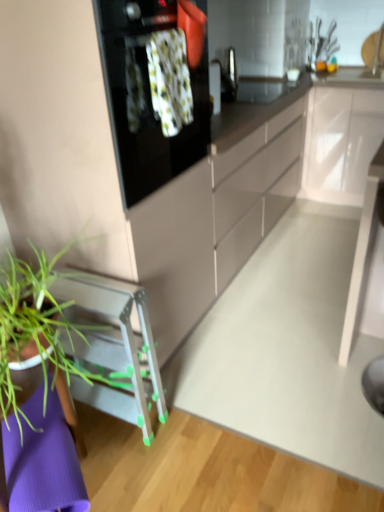
What is the approximate width of white glossy table at center?

21.30 inches.

Locate an element on the screen. The width and height of the screenshot is (384, 512). black glass oven at upper center is located at coordinates (146, 97).

In order to face white glossy cabinet at upper right, should I rotate leftwards or rightwards?

It's best to rotate right around 18.645 degrees.

Identify the location of white glossy table at center. The width and height of the screenshot is (384, 512). (363, 251).

Is black glass oven at upper center turned away from green plastic stool at lower left?

No, green plastic stool at lower left is not at the back of black glass oven at upper center.

Where is `furniture located underneath the black glass oven at upper center (from a real-world perspective)`? furniture located underneath the black glass oven at upper center (from a real-world perspective) is located at coordinates (112, 346).

Does black glass oven at upper center have a greater width compared to green plastic stool at lower left?

Incorrect, the width of black glass oven at upper center does not surpass that of green plastic stool at lower left.

Is black glass oven at upper center next to green plastic stool at lower left and touching it?

They are not placed beside each other.

Image resolution: width=384 pixels, height=512 pixels. In the image, there is a white glossy table at center. In order to click on kitchen appliance above it (from the image's perspective) in this screenshot , I will do `click(146, 97)`.

Does black glass oven at upper center touch white glossy table at center?

black glass oven at upper center is not next to white glossy table at center, and they're not touching.

Between black glass oven at upper center and white glossy table at center, which one has smaller size?

Smaller between the two is white glossy table at center.

In terms of width, does black glass oven at upper center look wider or thinner when compared to white glossy table at center?

Considering their sizes, black glass oven at upper center looks slimmer than white glossy table at center.

Are white glossy cabinet at upper right and black glass oven at upper center making contact?

There is a gap between white glossy cabinet at upper right and black glass oven at upper center.

Considering the relative sizes of white glossy cabinet at upper right and black glass oven at upper center in the image provided, is white glossy cabinet at upper right taller than black glass oven at upper center?

Correct, white glossy cabinet at upper right is much taller as black glass oven at upper center.

Is white glossy cabinet at upper right to the right of black glass oven at upper center from the viewer's perspective?

Yes.

From the image's perspective, is white glossy table at center beneath green plastic stool at lower left?

Actually, white glossy table at center appears above green plastic stool at lower left in the image.

Consider the image. Does white glossy table at center have a larger size compared to green plastic stool at lower left?

Indeed, white glossy table at center has a larger size compared to green plastic stool at lower left.

Is white glossy table at center at the right side of green plastic stool at lower left?

Indeed, white glossy table at center is positioned on the right side of green plastic stool at lower left.

Is white glossy table at center positioned far away from green plastic stool at lower left?

white glossy table at center is far away from green plastic stool at lower left.

How much distance is there between green plastic stool at lower left and white glossy cabinet at upper right?

green plastic stool at lower left and white glossy cabinet at upper right are 7.09 feet apart.

Is green plastic stool at lower left at the left side of white glossy cabinet at upper right?

Correct, you'll find green plastic stool at lower left to the left of white glossy cabinet at upper right.

Can you confirm if green plastic stool at lower left is smaller than white glossy cabinet at upper right?

Indeed, green plastic stool at lower left has a smaller size compared to white glossy cabinet at upper right.

Is white glossy cabinet at upper right at the back of green plastic stool at lower left?

No, green plastic stool at lower left is not facing away from white glossy cabinet at upper right.

Does point (140, 365) lie in front of point (361, 298)?

Yes, it is.

From the image's perspective, relative to white glossy table at center, is green plastic stool at lower left above or below?

Clearly, from the image's perspective, green plastic stool at lower left is below white glossy table at center.

From a real-world perspective, is green plastic stool at lower left below white glossy table at center?

Yes.

The width and height of the screenshot is (384, 512). Find the location of `furniture below the white glossy table at center (from a real-world perspective)`. furniture below the white glossy table at center (from a real-world perspective) is located at coordinates (112, 346).

From the image's perspective, is black glass oven at upper center below white glossy cabinet at upper right?

Indeed, from the image's perspective, black glass oven at upper center is shown beneath white glossy cabinet at upper right.

Is black glass oven at upper center not inside white glossy cabinet at upper right?

black glass oven at upper center is positioned outside white glossy cabinet at upper right.

In the scene shown: Considering the relative sizes of black glass oven at upper center and white glossy cabinet at upper right in the image provided, is black glass oven at upper center shorter than white glossy cabinet at upper right?

Indeed, black glass oven at upper center has a lesser height compared to white glossy cabinet at upper right.

From a real-world perspective, is black glass oven at upper center on white glossy cabinet at upper right?

Yes, from a real-world perspective, black glass oven at upper center is above white glossy cabinet at upper right.

This screenshot has height=512, width=384. Find the location of `kitchen appliance above the green plastic stool at lower left (from the image's perspective)`. kitchen appliance above the green plastic stool at lower left (from the image's perspective) is located at coordinates (146, 97).

Image resolution: width=384 pixels, height=512 pixels. Identify the location of table lying below the black glass oven at upper center (from the image's perspective). pos(363,251).

Considering their positions, is white glossy cabinet at upper right positioned closer to green plastic stool at lower left than black glass oven at upper center?

Among the two, black glass oven at upper center is located nearer to green plastic stool at lower left.

Looking at the image, which one is located closer to black glass oven at upper center, white glossy cabinet at upper right or white glossy table at center?

white glossy table at center.

Based on their spatial positions, is green plastic stool at lower left or white glossy table at center further from white glossy cabinet at upper right?

Based on the image, green plastic stool at lower left appears to be further to white glossy cabinet at upper right.

From the image, which object appears to be farther from white glossy table at center, white glossy cabinet at upper right or green plastic stool at lower left?

Based on the image, green plastic stool at lower left appears to be further to white glossy table at center.

Which object lies further to the anchor point white glossy cabinet at upper right, white glossy table at center or black glass oven at upper center?

The object further to white glossy cabinet at upper right is black glass oven at upper center.

Estimate the real-world distances between objects in this image. Which object is closer to white glossy table at center, black glass oven at upper center or green plastic stool at lower left?

The object closer to white glossy table at center is green plastic stool at lower left.

Which object lies further to the anchor point black glass oven at upper center, white glossy table at center or white glossy cabinet at upper right?

white glossy cabinet at upper right is further to black glass oven at upper center.

Which object lies further to the anchor point green plastic stool at lower left, black glass oven at upper center or white glossy cabinet at upper right?

Among the two, white glossy cabinet at upper right is located further to green plastic stool at lower left.

In order to click on furniture between white glossy table at center and white glossy cabinet at upper right along the z-axis in this screenshot , I will do (x=112, y=346).

Where is `kitchen appliance between green plastic stool at lower left and white glossy table at center in the horizontal direction`? kitchen appliance between green plastic stool at lower left and white glossy table at center in the horizontal direction is located at coordinates (146, 97).

The height and width of the screenshot is (512, 384). I want to click on table between black glass oven at upper center and white glossy cabinet at upper right in the front-back direction, so click(363, 251).

What are the coordinates of `furniture between black glass oven at upper center and white glossy cabinet at upper right along the z-axis` in the screenshot? It's located at (112, 346).